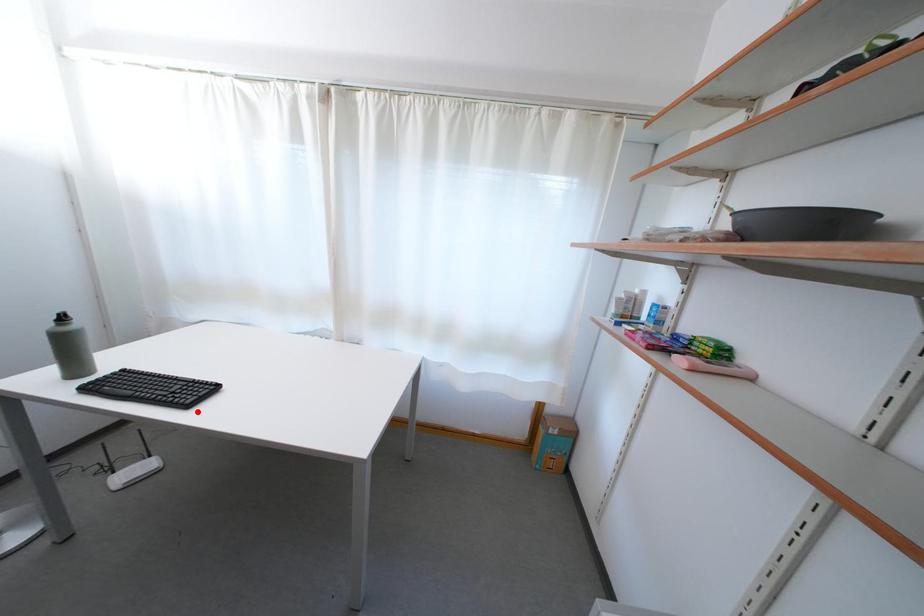
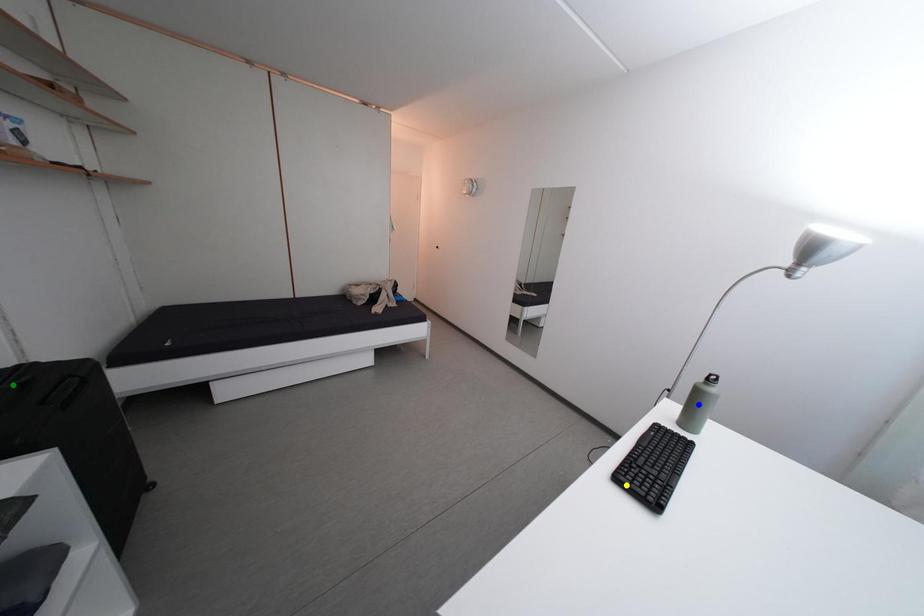
Question: I am providing you with two images of the same scene from different viewpoints. A red point is marked on the first image. You are given multiple points on the second image. Which mark in image 2 goes with the point in image 1?

Choices:
 (A) green point
 (B) yellow point
 (C) blue point

Answer: (B)